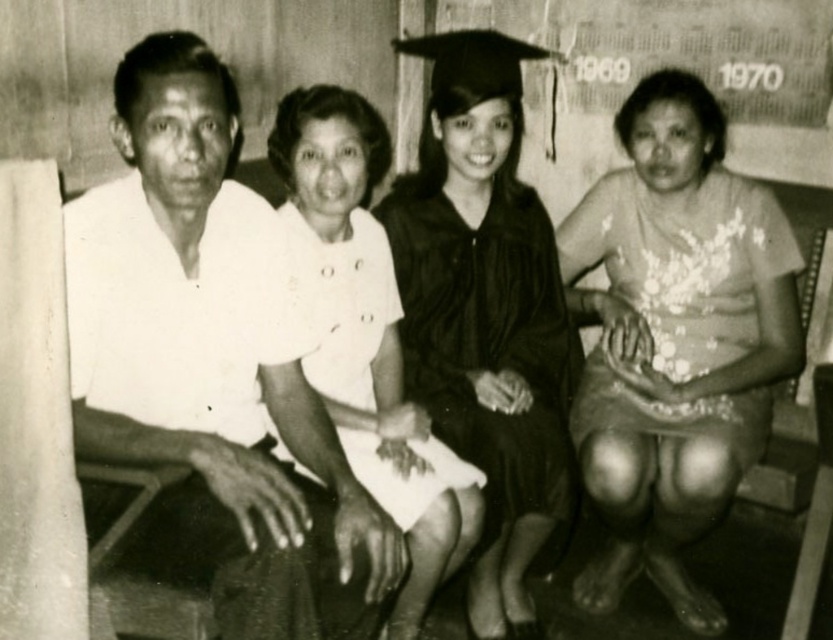
Question: Is matte black graduation gown at center smaller than white satin dress at center?

Choices:
 (A) no
 (B) yes

Answer: (A)

Question: Where is white matte shirt at left located in relation to white satin dress at center in the image?

Choices:
 (A) below
 (B) above

Answer: (A)

Question: In this image, where is matte black graduation gown at center located relative to white satin dress at center?

Choices:
 (A) left
 (B) right

Answer: (B)

Question: Among these objects, which one is nearest to the camera?

Choices:
 (A) matte black graduation gown at center
 (B) white floral dress at center

Answer: (B)

Question: Which object is the closest to the white floral dress at center?

Choices:
 (A) white matte shirt at left
 (B) matte black graduation gown at center

Answer: (B)

Question: Which object is farther from the camera taking this photo?

Choices:
 (A) white matte shirt at left
 (B) matte black graduation gown at center

Answer: (B)